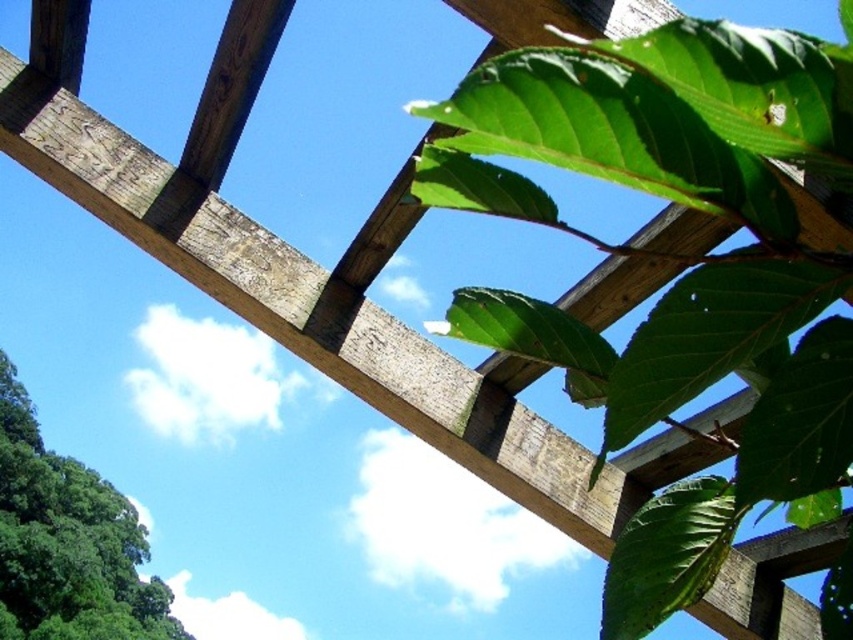
Who is positioned more to the left, green matte leaves at upper right or green leafy tree at lower left?

green leafy tree at lower left is more to the left.

Can you confirm if green matte leaves at upper right is positioned below green leafy tree at lower left?

No.

This screenshot has width=853, height=640. I want to click on green matte leaves at upper right, so click(672, 260).